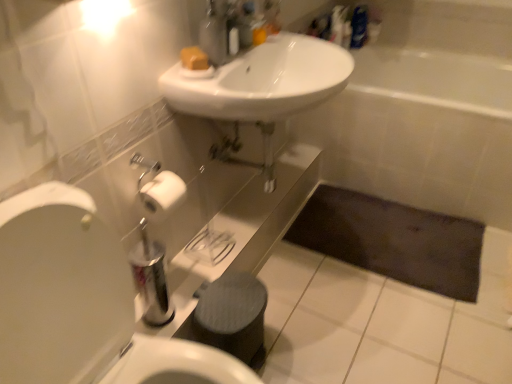
At what (x,y) coordinates should I click in order to perform the action: click on vacant space underneath dark fabric bath mat at lower center (from a real-world perspective). Please return your answer as a coordinate pair (x, y). Looking at the image, I should click on (387, 231).